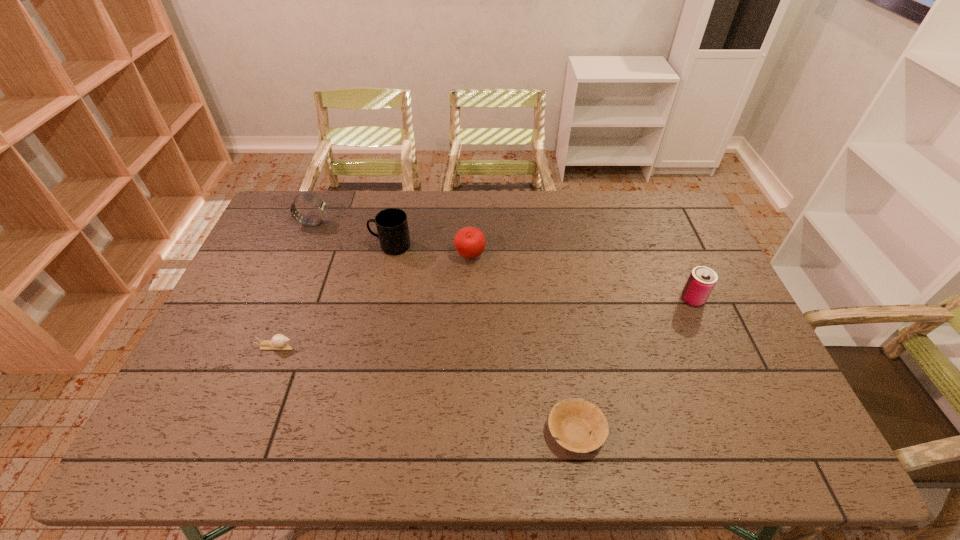
Where is `object that is at the right edge`? object that is at the right edge is located at coordinates (702, 280).

Find the location of `object present at the far left corner`. object present at the far left corner is located at coordinates (321, 205).

Image resolution: width=960 pixels, height=540 pixels. Find the location of `free space at the far edge of the desktop`. free space at the far edge of the desktop is located at coordinates (459, 226).

Where is `free region at the left edge of the desktop`? free region at the left edge of the desktop is located at coordinates (277, 310).

The image size is (960, 540). What are the coordinates of `vacant point at the right edge` in the screenshot? It's located at (722, 359).

This screenshot has height=540, width=960. In the image, there is a desktop. In order to click on free space at the far left corner in this screenshot , I will do `click(278, 221)`.

I want to click on free space at the near right corner, so click(756, 428).

Identify the location of free point between the rightmost object and the mug. (542, 273).

The image size is (960, 540). I want to click on free space between the escargot and the watch, so pos(295,285).

The image size is (960, 540). I want to click on free space between the second object from right to left and the rightmost object, so click(635, 366).